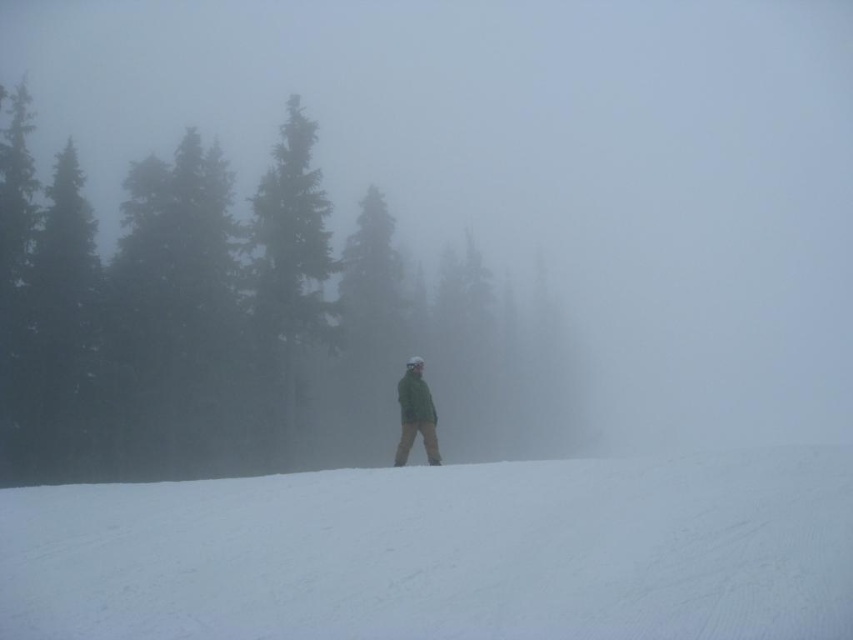
Which is more to the right, green textured pine tree at upper left or green matte jacket at center?

green matte jacket at center

Who is more distant from viewer, (329, 260) or (410, 428)?

Point (329, 260)

Identify the location of green textured pine tree at upper left. The image size is (853, 640). (285, 276).

Can you confirm if white snow at center is smaller than green textured pine tree at upper left?

Correct, white snow at center occupies less space than green textured pine tree at upper left.

Does white snow at center lie behind green textured pine tree at upper left?

No, white snow at center is closer to the viewer.

Describe the element at coordinates (442, 552) in the screenshot. This screenshot has width=853, height=640. I see `white snow at center` at that location.

Image resolution: width=853 pixels, height=640 pixels. What are the coordinates of `white snow at center` in the screenshot? It's located at (442, 552).

Is green matte tree at center closer to the viewer compared to white snow at center?

No, green matte tree at center is behind white snow at center.

Does green matte tree at center have a greater height compared to white snow at center?

Correct, green matte tree at center is much taller as white snow at center.

Is point (512, 332) positioned behind point (141, 620)?

Yes, it is behind point (141, 620).

Where is `green matte tree at center`? The image size is (853, 640). green matte tree at center is located at coordinates (248, 326).